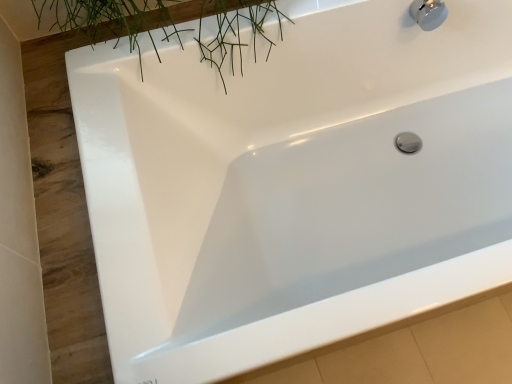
The height and width of the screenshot is (384, 512). I want to click on green grass at upper left, so click(x=161, y=23).

This screenshot has height=384, width=512. What do you see at coordinates (161, 23) in the screenshot?
I see `green grass at upper left` at bounding box center [161, 23].

Find the location of a particular element. green grass at upper left is located at coordinates (161, 23).